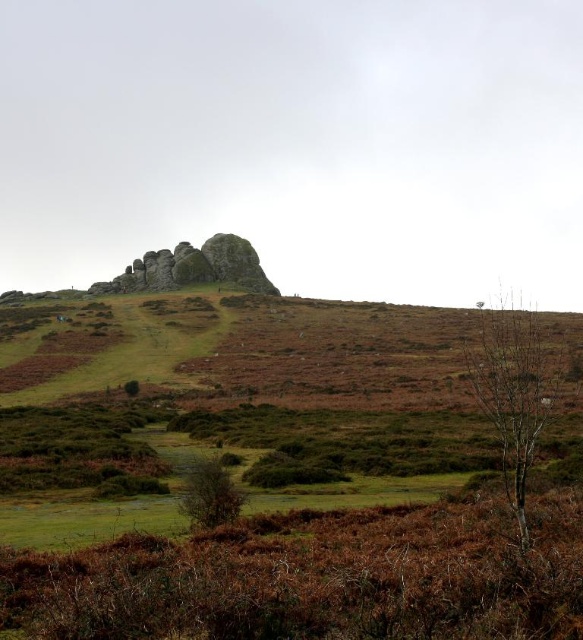
You are standing in the middle of the open land and want to walk to the edge of the rocky outcrop. Which object, the bare wood at right or the green matte tree at center, is wider and might block your path more if you go towards the rocky outcrop?

The bare wood at right is wider than the green matte tree at center, so it might block your path more if you go towards the rocky outcrop.

You are an explorer trying to cross this rugged landscape. You see a bare wood at right and a rustic stone rock formation at center. Which one has a wider span from left to right?

The bare wood at right has a wider span from left to right than the rustic stone rock formation at center.